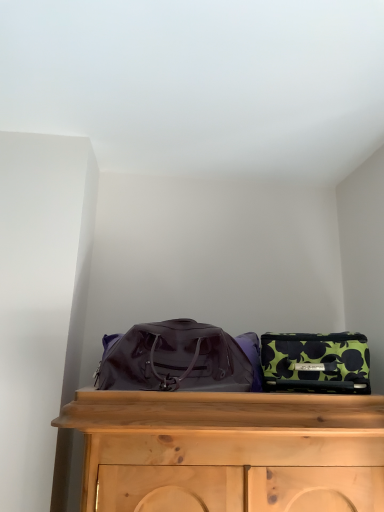
Question: Is green floral fabric bag at right, marked as the second luggage and bags in a left-to-right arrangement, situated inside glossy purple duffel bag at center, the 2th luggage and bags when ordered from right to left, or outside?

Choices:
 (A) outside
 (B) inside

Answer: (A)

Question: Would you say green floral fabric bag at right, marked as the second luggage and bags in a left-to-right arrangement, is to the left or to the right of glossy purple duffel bag at center, which is the first luggage and bags in left-to-right order, in the picture?

Choices:
 (A) left
 (B) right

Answer: (B)

Question: From their relative heights in the image, would you say green floral fabric bag at right, acting as the first luggage and bags starting from the right, is taller or shorter than glossy purple duffel bag at center, which is the first luggage and bags in left-to-right order?

Choices:
 (A) tall
 (B) short

Answer: (B)

Question: In terms of height, does glossy purple duffel bag at center, which is the first luggage and bags in left-to-right order, look taller or shorter compared to green floral fabric bag at right, marked as the second luggage and bags in a left-to-right arrangement?

Choices:
 (A) short
 (B) tall

Answer: (B)

Question: Which is correct: glossy purple duffel bag at center, which is the first luggage and bags in left-to-right order, is inside green floral fabric bag at right, acting as the first luggage and bags starting from the right, or outside of it?

Choices:
 (A) outside
 (B) inside

Answer: (A)

Question: Is point (243, 353) closer or farther from the camera than point (292, 335)?

Choices:
 (A) farther
 (B) closer

Answer: (B)

Question: From a real-world perspective, is glossy purple duffel bag at center, the 2th luggage and bags when ordered from right to left, above or below green floral fabric bag at right, marked as the second luggage and bags in a left-to-right arrangement?

Choices:
 (A) above
 (B) below

Answer: (A)